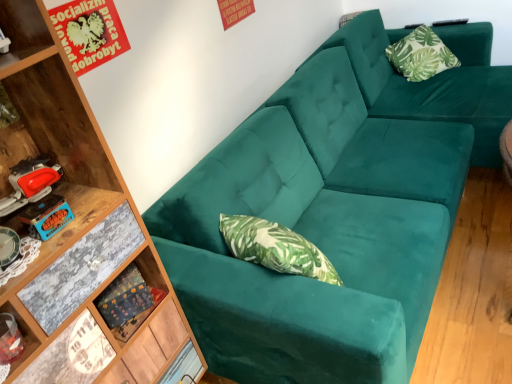
Question: Is wooden shelf at lower left further to camera compared to teal velvet couch at upper right?

Choices:
 (A) no
 (B) yes

Answer: (B)

Question: Is wooden shelf at lower left bigger than teal velvet couch at upper right?

Choices:
 (A) yes
 (B) no

Answer: (B)

Question: From the image's perspective, is wooden shelf at lower left located beneath teal velvet couch at upper right?

Choices:
 (A) no
 (B) yes

Answer: (B)

Question: Does wooden shelf at lower left have a greater height compared to teal velvet couch at upper right?

Choices:
 (A) no
 (B) yes

Answer: (A)

Question: Considering the relative positions of wooden shelf at lower left and teal velvet couch at upper right in the image provided, is wooden shelf at lower left to the left of teal velvet couch at upper right from the viewer's perspective?

Choices:
 (A) no
 (B) yes

Answer: (B)

Question: From the image's perspective, is wooden shelf at lower left positioned above or below green leafy fabric pillow at upper right?

Choices:
 (A) below
 (B) above

Answer: (A)

Question: Is wooden shelf at lower left taller or shorter than green leafy fabric pillow at upper right?

Choices:
 (A) tall
 (B) short

Answer: (B)

Question: Looking at their shapes, would you say wooden shelf at lower left is wider or thinner than green leafy fabric pillow at upper right?

Choices:
 (A) wide
 (B) thin

Answer: (B)

Question: Is wooden shelf at lower left inside or outside of green leafy fabric pillow at upper right?

Choices:
 (A) inside
 (B) outside

Answer: (B)

Question: From the image's perspective, is wooden shelf at lower left above or below teal velvet couch at upper right?

Choices:
 (A) above
 (B) below

Answer: (B)

Question: Relative to teal velvet couch at upper right, is wooden shelf at lower left in front or behind?

Choices:
 (A) front
 (B) behind

Answer: (B)

Question: Considering the positions of wooden shelf at lower left and teal velvet couch at upper right in the image, is wooden shelf at lower left taller or shorter than teal velvet couch at upper right?

Choices:
 (A) short
 (B) tall

Answer: (A)

Question: Considering the positions of point (153, 294) and point (453, 140), is point (153, 294) closer or farther from the camera than point (453, 140)?

Choices:
 (A) farther
 (B) closer

Answer: (B)

Question: Visually, is green leafy fabric pillow at upper right positioned to the left or to the right of wooden shelf at lower left?

Choices:
 (A) right
 (B) left

Answer: (A)

Question: Looking at their shapes, would you say green leafy fabric pillow at upper right is wider or thinner than wooden shelf at lower left?

Choices:
 (A) wide
 (B) thin

Answer: (A)